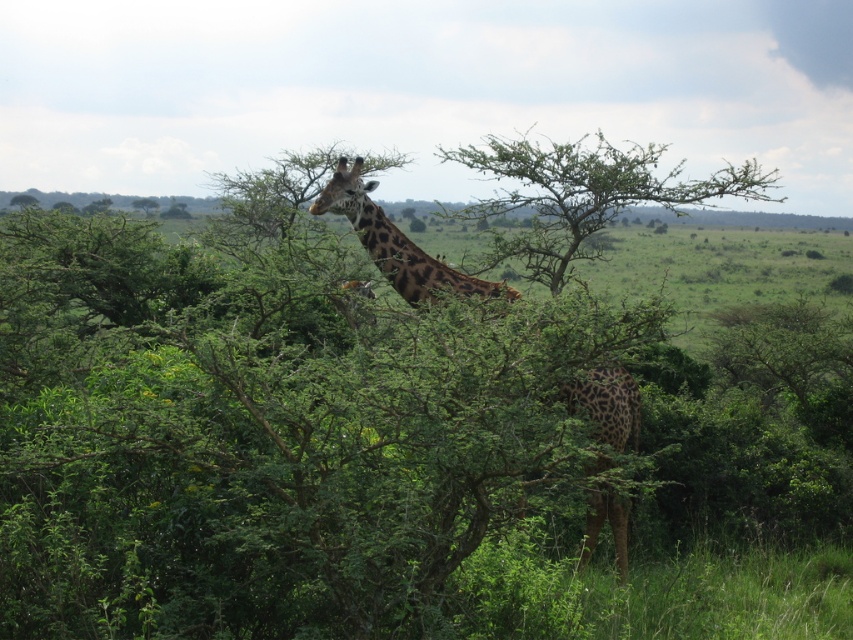
You are a photographer trying to capture a clear shot of the spotted fur giraffe at center. However, there is a green leafy tree at center blocking your view. Based on the scene description, can you determine if the tree is in front of or behind the giraffe?

The green leafy tree at center is above the spotted fur giraffe at center, meaning the tree is positioned above the giraffe, not in front or behind. Therefore, the tree might still allow a clear shot of the giraffe below it.

Based on the coordinates provided, where is the green leafy bush at center located in the image?

The green leafy bush at center is located at the 2D coordinates point (x=341, y=444).

You are a wildlife photographer aiming to capture a clear photo of the spotted fur giraffe at center. However, there is a green leafy tree at center blocking your view. Based on the scene description, can you determine if you need to move closer or further away to get a clearer shot of the giraffe without the tree obstructing it?

The spotted fur giraffe at center is behind the green leafy tree at center. To avoid the obstruction, you should move closer to the giraffe, as it is positioned behind the tree. However, since the tree is in the center, moving closer might not fully eliminate the obstruction. Alternatively, adjusting your angle could help, but based on the description, moving closer to the giraffe would reduce the tree between you and the giraffe.